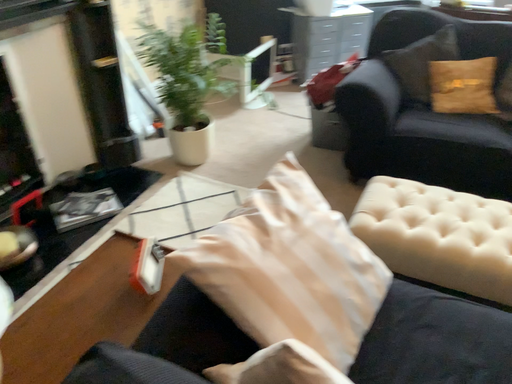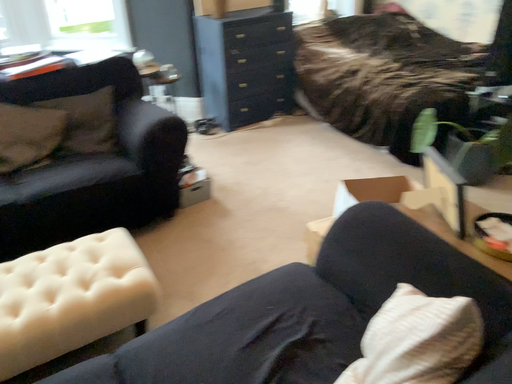
Question: How did the camera likely rotate when shooting the video?

Choices:
 (A) rotated right
 (B) rotated left

Answer: (A)